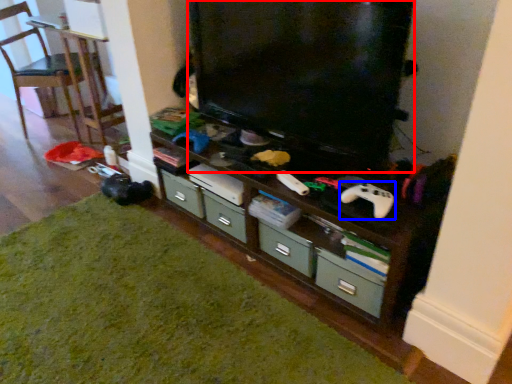
Question: Among these objects, which one is nearest to the camera, television (highlighted by a red box) or game controller (highlighted by a blue box)?

Choices:
 (A) television
 (B) game controller

Answer: (A)